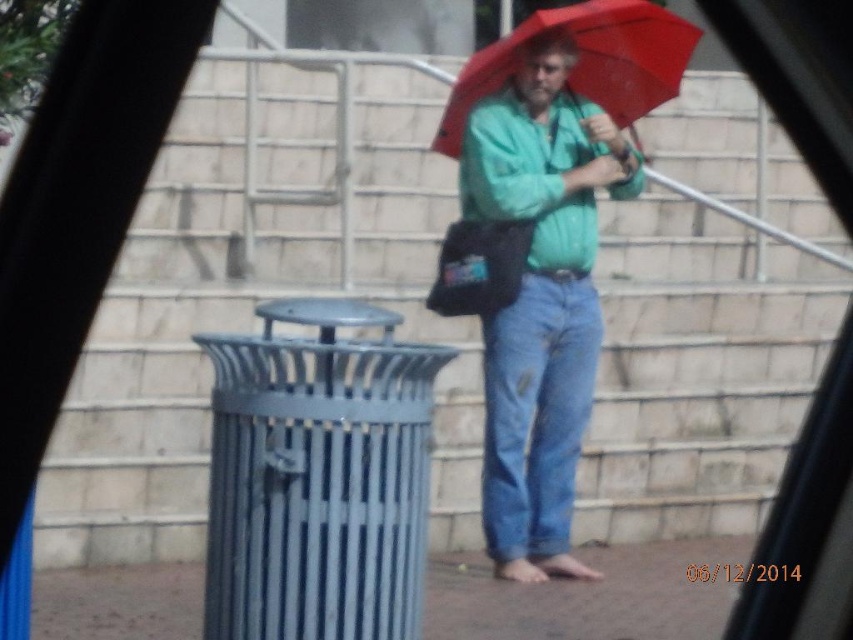
You are a fashion designer observing a pedestrian outside your car window. You notice the green matte shirt at center and the red matte umbrella at center. Which item appears narrower when viewed from your position inside the car?

The green matte shirt at center has a lesser width compared to the red matte umbrella at center, so the green matte shirt at center appears narrower.

You are a fashion designer observing a pedestrian in the rain. You notice the green matte shirt at center and the red matte umbrella at center. Which item appears bigger in the scene?

The green matte shirt at center has a larger size compared to the red matte umbrella at center, so the green matte shirt at center appears bigger.

You are a delivery driver who needs to check the distance between the green matte shirt at center and the red matte umbrella at center to ensure your package can fit between them. Can you fit a 20 inch wide package between them?

The green matte shirt at center and red matte umbrella at center are 22.08 inches apart, so yes, the 20 inch wide package can fit between them since the space is wider than the package.